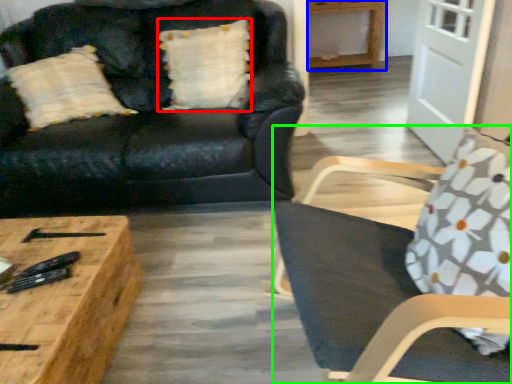
Question: Estimate the real-world distances between objects in this image. Which object is farther from pillow (highlighted by a red box), hardwood (highlighted by a blue box) or chair (highlighted by a green box)?

Choices:
 (A) hardwood
 (B) chair

Answer: (A)